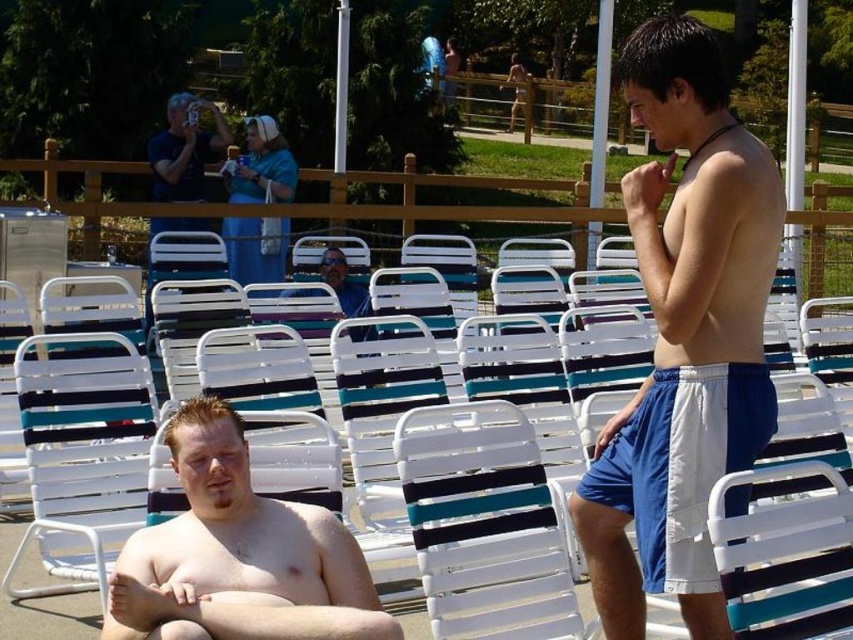
Question: Which object appears farthest from the camera in this image?

Choices:
 (A) white plastic chair at lower left
 (B) smooth tan skin at center
 (C) matte black camera at upper left
 (D) matte blue shirt at center

Answer: (C)

Question: Can you confirm if white plastic beach chair at center is smaller than blue/white mesh shorts at right?

Choices:
 (A) yes
 (B) no

Answer: (B)

Question: Which point is farther to the camera?

Choices:
 (A) matte blue shirt at center
 (B) white plastic beach chair at center

Answer: (A)

Question: Is white cotton shorts at center to the left of white plastic chair at lower left from the viewer's perspective?

Choices:
 (A) yes
 (B) no

Answer: (B)

Question: Which of the following is the farthest from the observer?

Choices:
 (A) (360, 253)
 (B) (639, 465)

Answer: (A)

Question: Is white plastic beach chair at center thinner than matte blue shirt at center?

Choices:
 (A) no
 (B) yes

Answer: (A)